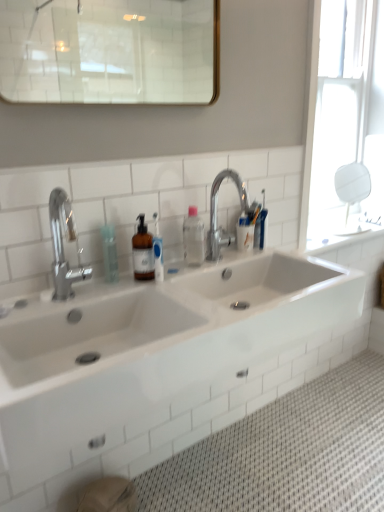
Question: Is transparent plastic bottle at center closer to camera compared to silver metallic faucet at upper center, arranged as the second tap when viewed from the left?

Choices:
 (A) no
 (B) yes

Answer: (B)

Question: Could you tell me if transparent plastic bottle at center is facing silver metallic faucet at upper center, which is the 2th tap from front to back?

Choices:
 (A) yes
 (B) no

Answer: (B)

Question: Is transparent plastic bottle at center facing away from silver metallic faucet at upper center, which ranks as the 1th tap in back-to-front order?

Choices:
 (A) yes
 (B) no

Answer: (B)

Question: Considering the relative sizes of transparent plastic bottle at center and silver metallic faucet at upper center, which ranks as the 1th tap in back-to-front order, in the image provided, is transparent plastic bottle at center taller than silver metallic faucet at upper center, which ranks as the 1th tap in back-to-front order,?

Choices:
 (A) no
 (B) yes

Answer: (A)

Question: Does transparent plastic bottle at center have a larger size compared to silver metallic faucet at upper center, which ranks as the 1th tap in back-to-front order?

Choices:
 (A) no
 (B) yes

Answer: (A)

Question: Can you confirm if transparent plastic bottle at center is positioned to the left of silver metallic faucet at upper center, which is counted as the first tap, starting from the right?

Choices:
 (A) yes
 (B) no

Answer: (A)

Question: From the image's perspective, is transparent plastic bottle at center above silver metallic faucet at upper center, which is counted as the first tap, starting from the right?

Choices:
 (A) yes
 (B) no

Answer: (B)

Question: Can you confirm if transparent plastic bottle at center is wider than silver metallic faucet at upper center, which is counted as the first tap, starting from the right?

Choices:
 (A) yes
 (B) no

Answer: (B)

Question: Can you confirm if transparent plastic bottle at center is taller than silver metallic faucet at upper center, arranged as the second tap when viewed from the left?

Choices:
 (A) yes
 (B) no

Answer: (B)

Question: Considering the relative sizes of transparent plastic bottle at center and silver metallic faucet at upper center, which is counted as the first tap, starting from the right, in the image provided, is transparent plastic bottle at center smaller than silver metallic faucet at upper center, which is counted as the first tap, starting from the right,?

Choices:
 (A) yes
 (B) no

Answer: (A)

Question: Can you confirm if transparent plastic bottle at center is bigger than silver metallic faucet at upper center, which is counted as the first tap, starting from the right?

Choices:
 (A) no
 (B) yes

Answer: (A)

Question: From a real-world perspective, is transparent plastic bottle at center located beneath silver metallic faucet at upper center, which is counted as the first tap, starting from the right?

Choices:
 (A) no
 (B) yes

Answer: (B)

Question: Can you confirm if silver metallic faucet at upper center, arranged as the second tap when viewed from the left, is bigger than transparent plastic bottle at center?

Choices:
 (A) yes
 (B) no

Answer: (A)